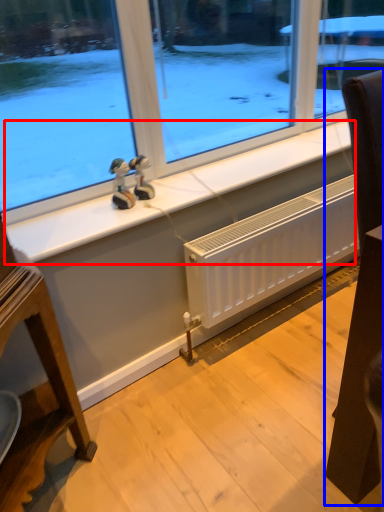
Question: Which object is closer to the camera taking this photo, window sill (highlighted by a red box) or furniture (highlighted by a blue box)?

Choices:
 (A) window sill
 (B) furniture

Answer: (B)